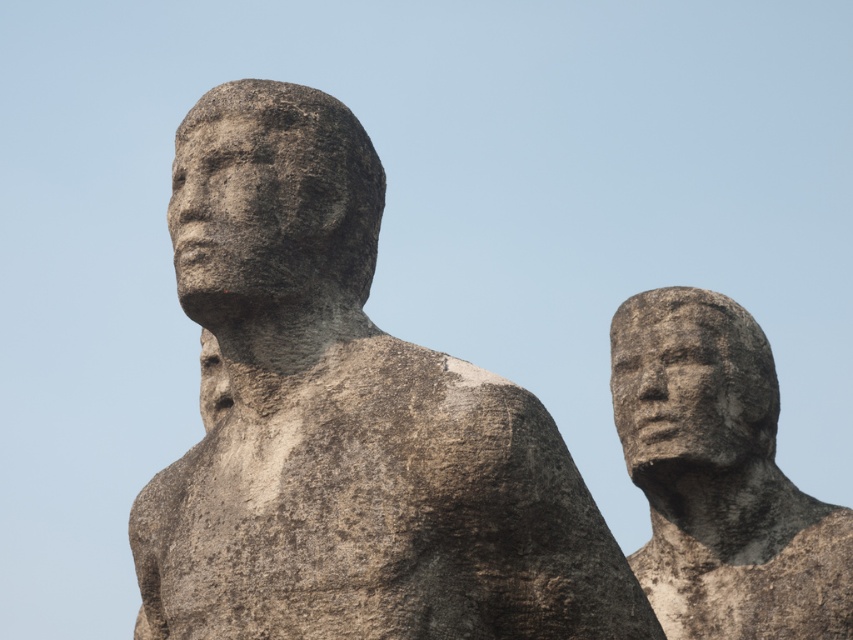
Question: Which object is closer to the camera taking this photo?

Choices:
 (A) gray stone statue at right
 (B) gray stone statue at center

Answer: (B)

Question: Considering the relative positions of gray stone statue at center and gray stone statue at right in the image provided, where is gray stone statue at center located with respect to gray stone statue at right?

Choices:
 (A) left
 (B) right

Answer: (A)

Question: Among these objects, which one is nearest to the camera?

Choices:
 (A) gray stone statue at right
 (B) gray stone statue at center

Answer: (B)

Question: Which object appears closest to the camera in this image?

Choices:
 (A) gray stone statue at right
 (B) gray stone statue at center

Answer: (B)

Question: Does gray stone statue at center have a greater width compared to gray stone statue at right?

Choices:
 (A) no
 (B) yes

Answer: (B)

Question: Does gray stone statue at center appear on the left side of gray stone statue at right?

Choices:
 (A) no
 (B) yes

Answer: (B)